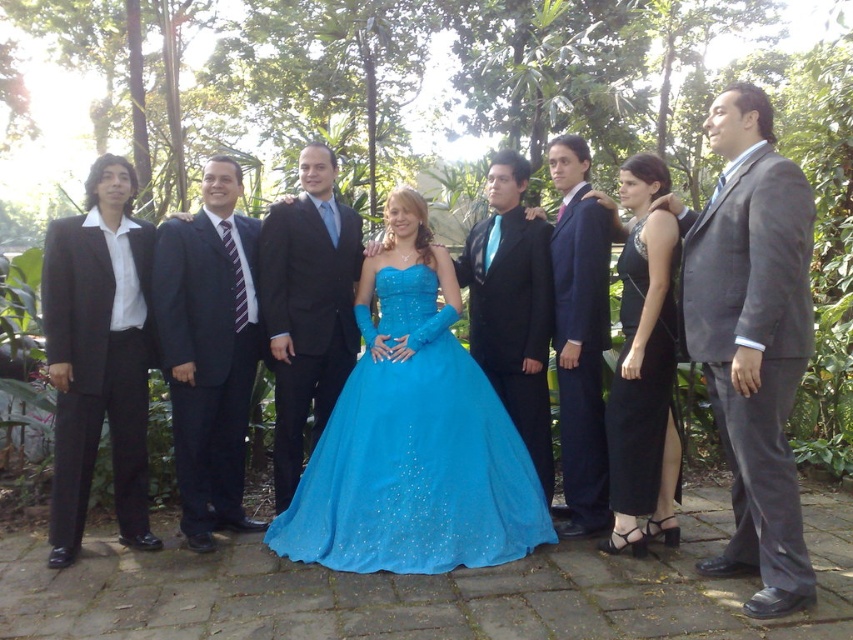
Can you confirm if gray suit at right is bigger than satin dark blue suit at center?

Yes, gray suit at right is bigger than satin dark blue suit at center.

Is point (688, 268) more distant than point (583, 401)?

No, it is in front of (583, 401).

Locate an element on the screen. This screenshot has width=853, height=640. gray suit at right is located at coordinates (752, 339).

Is dark blue suit at center above shiny black suit at center?

No.

Find the location of a particular element. Image resolution: width=853 pixels, height=640 pixels. dark blue suit at center is located at coordinates (209, 349).

Which is in front, point (167, 372) or point (338, 362)?

Point (167, 372)

The image size is (853, 640). I want to click on dark blue suit at center, so click(x=209, y=349).

Which is above, black smooth suit at left or matte black suit at center?

Positioned higher is matte black suit at center.

Who is taller, black smooth suit at left or matte black suit at center?

Standing taller between the two is matte black suit at center.

Identify the location of black smooth suit at left. Image resolution: width=853 pixels, height=640 pixels. (96, 372).

Where is `black smooth suit at left`? black smooth suit at left is located at coordinates (96, 372).